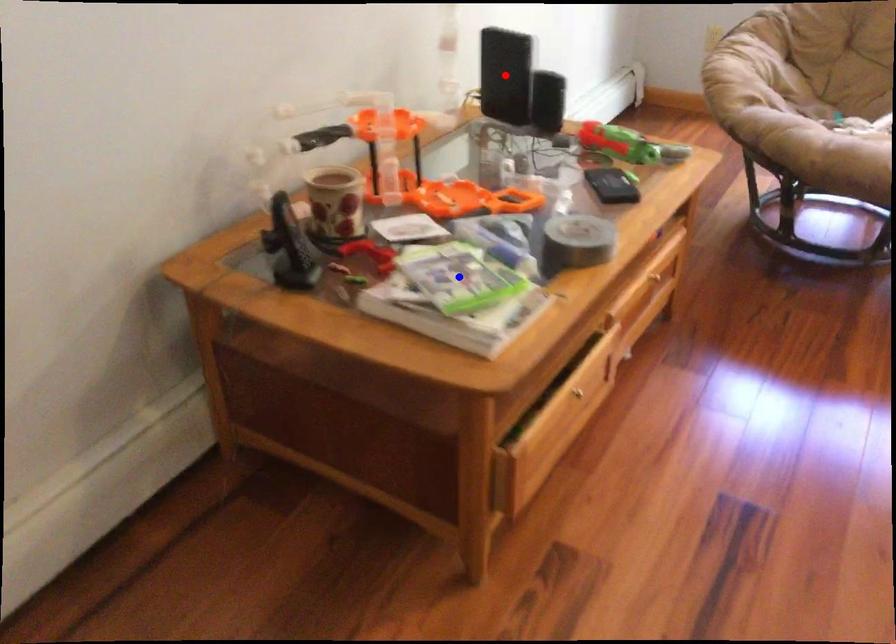
Question: Which of the two points in the image is closer to the camera?

Choices:
 (A) Blue point is closer.
 (B) Red point is closer.

Answer: (A)